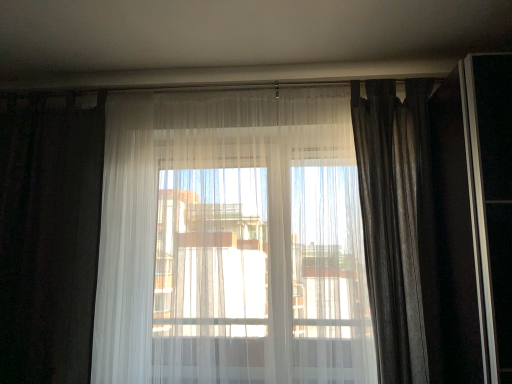
Locate an element on the screen. The image size is (512, 384). silky gray curtain at right, which is the first curtain in right-to-left order is located at coordinates (395, 222).

This screenshot has height=384, width=512. Find the location of `sheer white curtain at center, which ranks as the 2th curtain in right-to-left order`. sheer white curtain at center, which ranks as the 2th curtain in right-to-left order is located at coordinates (231, 241).

The image size is (512, 384). What are the coordinates of `silky gray curtain at right, the 3th curtain in the left-to-right sequence` in the screenshot? It's located at (395, 222).

Which object is closer to the camera taking this photo, silky gray curtain at right, the 3th curtain in the left-to-right sequence, or sheer white curtain at center, which ranks as the 2th curtain in right-to-left order?

sheer white curtain at center, which ranks as the 2th curtain in right-to-left order, is in front.

Considering the relative sizes of silky gray curtain at right, which is the first curtain in right-to-left order, and sheer white curtain at center, which ranks as the 2th curtain in right-to-left order, in the image provided, is silky gray curtain at right, which is the first curtain in right-to-left order, shorter than sheer white curtain at center, which ranks as the 2th curtain in right-to-left order,?

Indeed, silky gray curtain at right, which is the first curtain in right-to-left order, has a lesser height compared to sheer white curtain at center, which ranks as the 2th curtain in right-to-left order.

Looking at this image, is sheer white curtain at center, the 2th curtain from the left, inside silky gray curtain at right, which is the first curtain in right-to-left order?

No, sheer white curtain at center, the 2th curtain from the left, is located outside of silky gray curtain at right, which is the first curtain in right-to-left order.

Would you say sheer white curtain at center, the 2th curtain from the left, is to the left or to the right of white sheer curtain at left, the 3th curtain positioned from the right, in the picture?

From the image, it's evident that sheer white curtain at center, the 2th curtain from the left, is to the right of white sheer curtain at left, the 3th curtain positioned from the right.

Is point (150, 308) positioned before point (77, 309)?

No.

Image resolution: width=512 pixels, height=384 pixels. I want to click on curtain located underneath the white sheer curtain at left, the first curtain positioned from the left (from a real-world perspective), so click(231, 241).

Considering the relative sizes of sheer white curtain at center, which ranks as the 2th curtain in right-to-left order, and white sheer curtain at left, the first curtain positioned from the left, in the image provided, is sheer white curtain at center, which ranks as the 2th curtain in right-to-left order, wider than white sheer curtain at left, the first curtain positioned from the left,?

Yes.

Is silky gray curtain at right, the 3th curtain in the left-to-right sequence, looking in the opposite direction of white sheer curtain at left, the 3th curtain positioned from the right?

No.

Which of these two, silky gray curtain at right, the 3th curtain in the left-to-right sequence, or white sheer curtain at left, the 3th curtain positioned from the right, stands taller?

white sheer curtain at left, the 3th curtain positioned from the right, is taller.

From the image's perspective, is silky gray curtain at right, which is the first curtain in right-to-left order, under white sheer curtain at left, the 3th curtain positioned from the right?

Incorrect, from the image's perspective, silky gray curtain at right, which is the first curtain in right-to-left order, is higher than white sheer curtain at left, the 3th curtain positioned from the right.

Which object is further away from the camera, silky gray curtain at right, the 3th curtain in the left-to-right sequence, or white sheer curtain at left, the first curtain positioned from the left?

white sheer curtain at left, the first curtain positioned from the left, is further away from the camera.

Is white sheer curtain at left, the 3th curtain positioned from the right, aimed at sheer white curtain at center, which ranks as the 2th curtain in right-to-left order?

No.

Which is farther, (63, 136) or (346, 346)?

The point (63, 136) is more distant.

Is white sheer curtain at left, the first curtain positioned from the left, not inside sheer white curtain at center, which ranks as the 2th curtain in right-to-left order?

Yes.

Which is correct: sheer white curtain at center, which ranks as the 2th curtain in right-to-left order, is inside silky gray curtain at right, the 3th curtain in the left-to-right sequence, or outside of it?

sheer white curtain at center, which ranks as the 2th curtain in right-to-left order, cannot be found inside silky gray curtain at right, the 3th curtain in the left-to-right sequence.

Is point (234, 247) closer or farther from the camera than point (402, 235)?

Point (234, 247) is farther from the camera than point (402, 235).

In terms of size, does sheer white curtain at center, which ranks as the 2th curtain in right-to-left order, appear bigger or smaller than silky gray curtain at right, which is the first curtain in right-to-left order?

Clearly, sheer white curtain at center, which ranks as the 2th curtain in right-to-left order, is larger in size than silky gray curtain at right, which is the first curtain in right-to-left order.

Is sheer white curtain at center, which ranks as the 2th curtain in right-to-left order, next to silky gray curtain at right, which is the first curtain in right-to-left order?

They are not placed beside each other.

Is silky gray curtain at right, which is the first curtain in right-to-left order, at the back of white sheer curtain at left, the first curtain positioned from the left?

No, silky gray curtain at right, which is the first curtain in right-to-left order, is not at the back of white sheer curtain at left, the first curtain positioned from the left.

Find the location of a particular element. Image resolution: width=512 pixels, height=384 pixels. the 2nd curtain counting from the right side of the white sheer curtain at left, the first curtain positioned from the left is located at coordinates (395, 222).

Would you say white sheer curtain at left, the first curtain positioned from the left, is to the left or to the right of silky gray curtain at right, which is the first curtain in right-to-left order, in the picture?

white sheer curtain at left, the first curtain positioned from the left, is positioned on silky gray curtain at right, which is the first curtain in right-to-left order,'s left side.

Is white sheer curtain at left, the first curtain positioned from the left, outside of silky gray curtain at right, the 3th curtain in the left-to-right sequence?

Yes, white sheer curtain at left, the first curtain positioned from the left, is outside of silky gray curtain at right, the 3th curtain in the left-to-right sequence.

From the silky gray curtain at right, the 3th curtain in the left-to-right sequence, count the 1st curtain to the left and point to it. Please provide its 2D coordinates.

[(231, 241)]

From the sheer white curtain at center, the 2th curtain from the left, count 2nd curtains backward and point to it. Please provide its 2D coordinates.

[(49, 234)]

When comparing their distances from sheer white curtain at center, which ranks as the 2th curtain in right-to-left order, does white sheer curtain at left, the 3th curtain positioned from the right, or silky gray curtain at right, the 3th curtain in the left-to-right sequence, seem closer?

Based on the image, white sheer curtain at left, the 3th curtain positioned from the right, appears to be nearer to sheer white curtain at center, which ranks as the 2th curtain in right-to-left order.

When comparing their distances from silky gray curtain at right, the 3th curtain in the left-to-right sequence, does white sheer curtain at left, the first curtain positioned from the left, or sheer white curtain at center, which ranks as the 2th curtain in right-to-left order, seem closer?

sheer white curtain at center, which ranks as the 2th curtain in right-to-left order, is closer to silky gray curtain at right, the 3th curtain in the left-to-right sequence.

When comparing their distances from silky gray curtain at right, the 3th curtain in the left-to-right sequence, does sheer white curtain at center, which ranks as the 2th curtain in right-to-left order, or white sheer curtain at left, the 3th curtain positioned from the right, seem closer?

Based on the image, sheer white curtain at center, which ranks as the 2th curtain in right-to-left order, appears to be nearer to silky gray curtain at right, the 3th curtain in the left-to-right sequence.

From the image, which object appears to be farther from sheer white curtain at center, which ranks as the 2th curtain in right-to-left order, silky gray curtain at right, the 3th curtain in the left-to-right sequence, or white sheer curtain at left, the 3th curtain positioned from the right?

silky gray curtain at right, the 3th curtain in the left-to-right sequence, is positioned further to the anchor sheer white curtain at center, which ranks as the 2th curtain in right-to-left order.

Estimate the real-world distances between objects in this image. Which object is closer to white sheer curtain at left, the 3th curtain positioned from the right, silky gray curtain at right, the 3th curtain in the left-to-right sequence, or sheer white curtain at center, which ranks as the 2th curtain in right-to-left order?

sheer white curtain at center, which ranks as the 2th curtain in right-to-left order.

Which object lies further to the anchor point white sheer curtain at left, the 3th curtain positioned from the right, sheer white curtain at center, which ranks as the 2th curtain in right-to-left order, or silky gray curtain at right, the 3th curtain in the left-to-right sequence?

Based on the image, silky gray curtain at right, the 3th curtain in the left-to-right sequence, appears to be further to white sheer curtain at left, the 3th curtain positioned from the right.

This screenshot has height=384, width=512. I want to click on curtain situated between white sheer curtain at left, the 3th curtain positioned from the right, and silky gray curtain at right, the 3th curtain in the left-to-right sequence, from left to right, so click(231, 241).